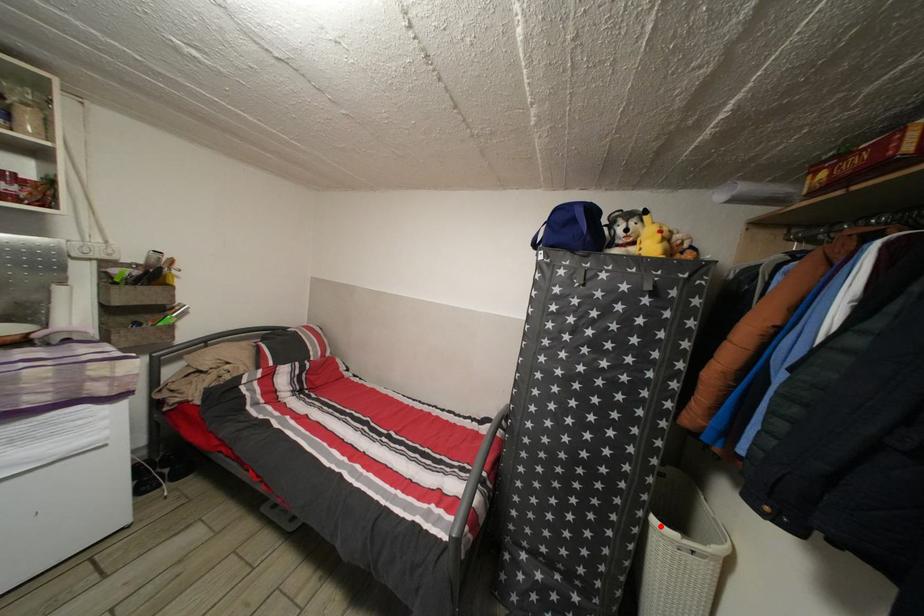
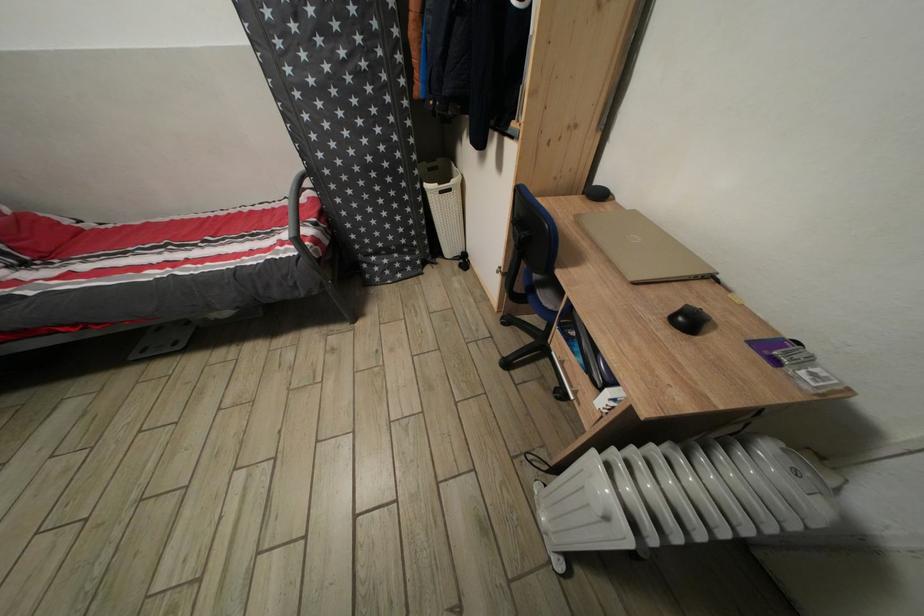
Where in the second image is the point corresponding to the highlighted location from the first image?

(432, 192)